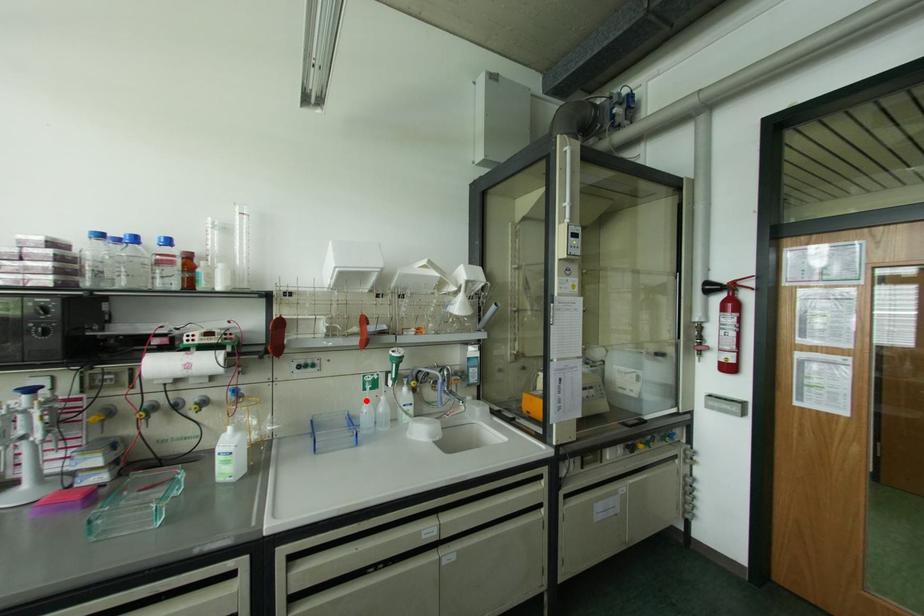
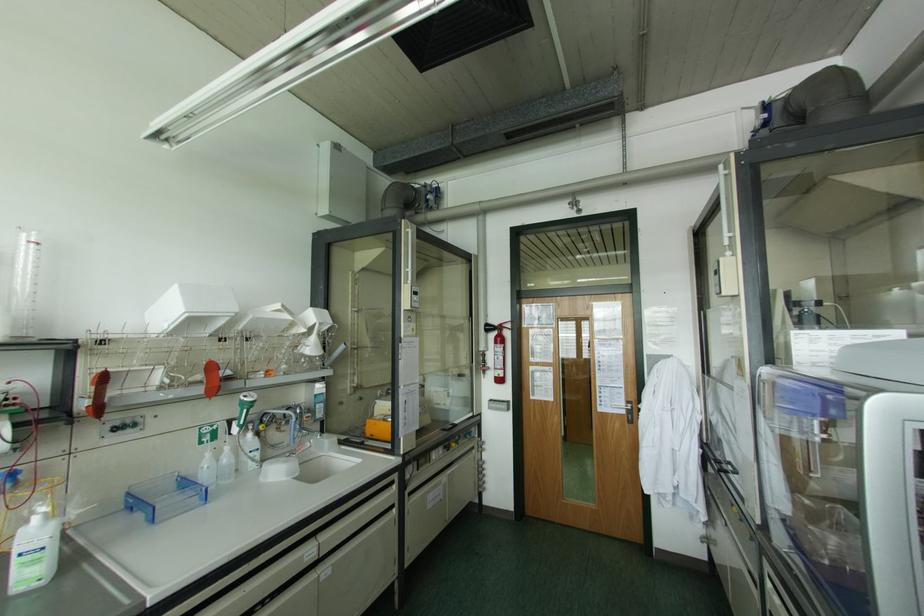
Locate, in the second image, the point that corresponds to the highlighted location in the first image.

(208, 454)